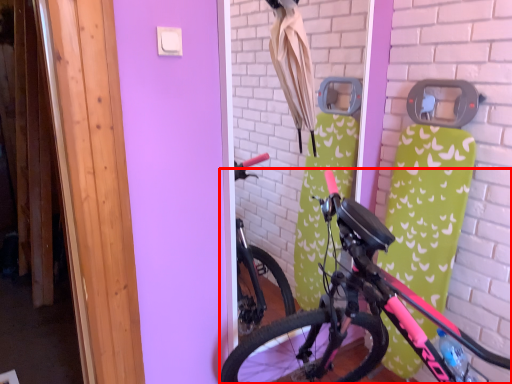
Question: From the image's perspective, where is bicycle (annotated by the red box) located relative to umbrella?

Choices:
 (A) below
 (B) above

Answer: (A)